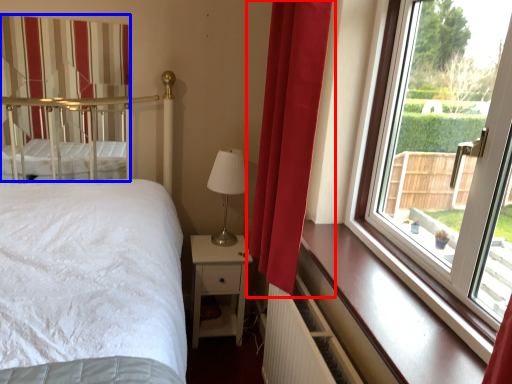
Question: Which point is further to the camera, curtain (highlighted by a red box) or curtain (highlighted by a blue box)?

Choices:
 (A) curtain
 (B) curtain

Answer: (B)